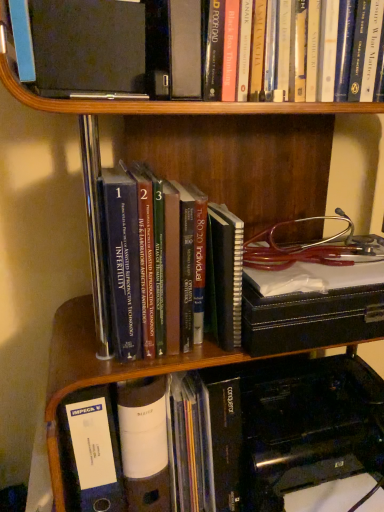
Question: From a real-world perspective, relative to hardcover book at upper center, which is the 3th book in bottom-to-top order, is orange matte book at center, which is counted as the first book, starting from the bottom, vertically above or below?

Choices:
 (A) below
 (B) above

Answer: (A)

Question: Do you think orange matte book at center, which is the third book in top-to-bottom order, is within hardcover book at upper center, which is the 3th book in bottom-to-top order, or outside of it?

Choices:
 (A) outside
 (B) inside

Answer: (A)

Question: Which object is the farthest from the hardcover book at upper center, acting as the 1th book starting from the top?

Choices:
 (A) orange matte book at center, which is the third book in top-to-bottom order
 (B) blue hardcover books at center, the 2th book positioned from the bottom

Answer: (B)

Question: Which of these objects is positioned farthest from the orange matte book at center, which is the third book in top-to-bottom order?

Choices:
 (A) blue hardcover books at center, the 2th book positioned from the bottom
 (B) hardcover book at upper center, acting as the 1th book starting from the top

Answer: (B)